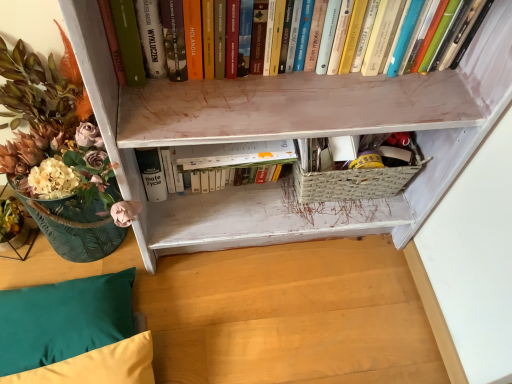
Locate an element on the screen. vacant area on top of woven straw basket at lower center (from a real-world perspective) is located at coordinates (367, 155).